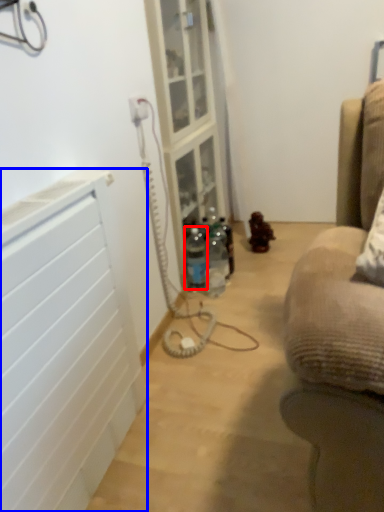
Question: Which of the following is the closest to the observer, bottle (highlighted by a red box) or radiator (highlighted by a blue box)?

Choices:
 (A) bottle
 (B) radiator

Answer: (B)